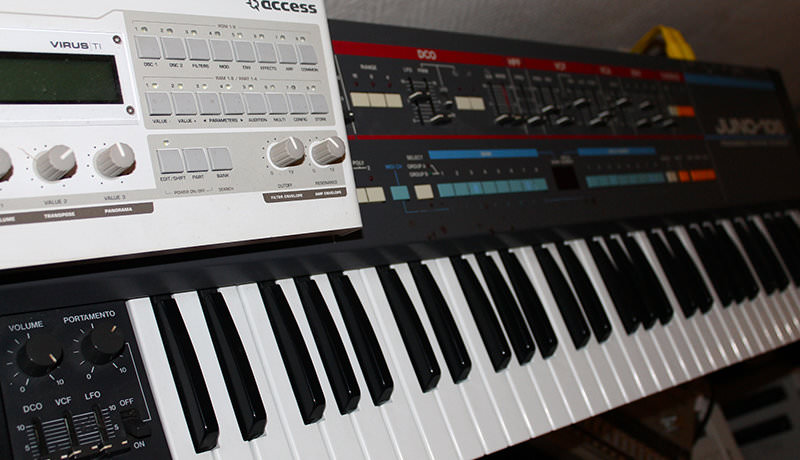
At what (x,y) coordinates should I click in order to perform the action: click on wall behind the keyboard. Please return your answer as a coordinate pair (x, y). The image size is (800, 460). Looking at the image, I should click on (382, 10), (534, 19), (618, 28), (726, 19), (760, 42).